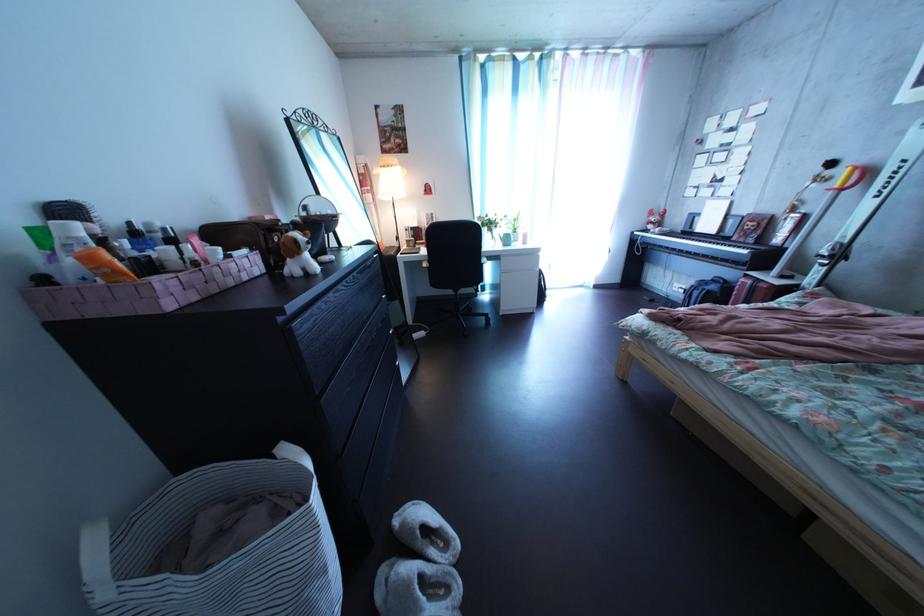
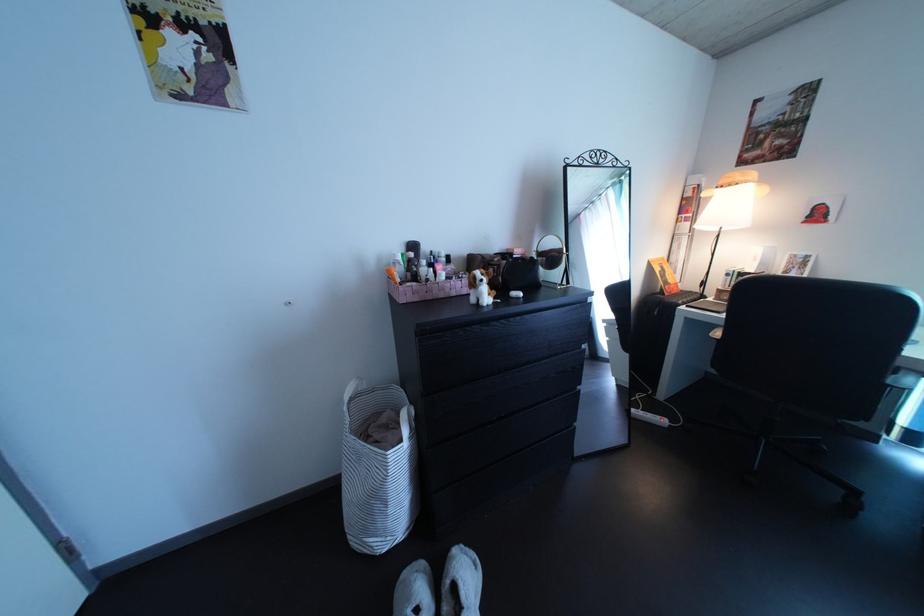
Where in the second image is the point corresponding to [116,248] from the first image?

(424, 269)